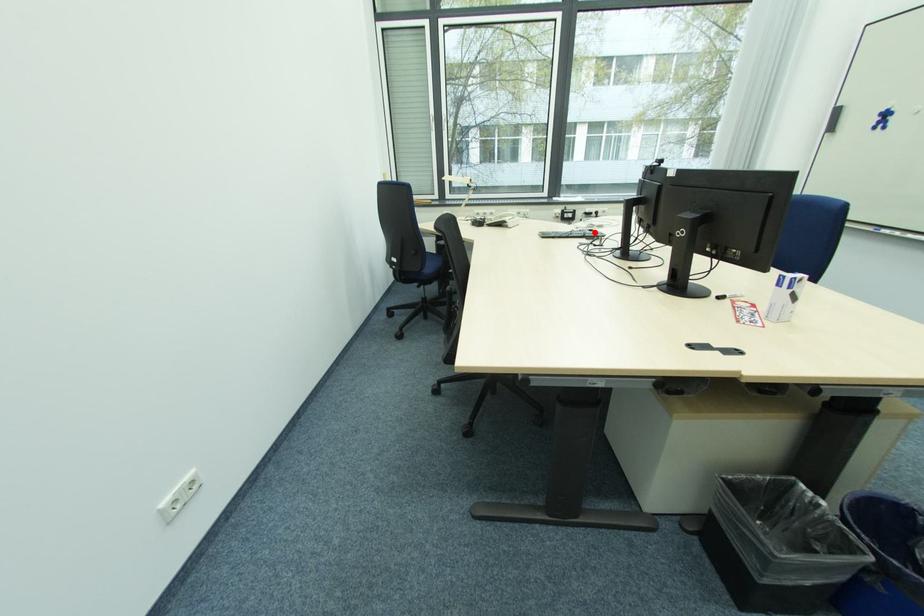
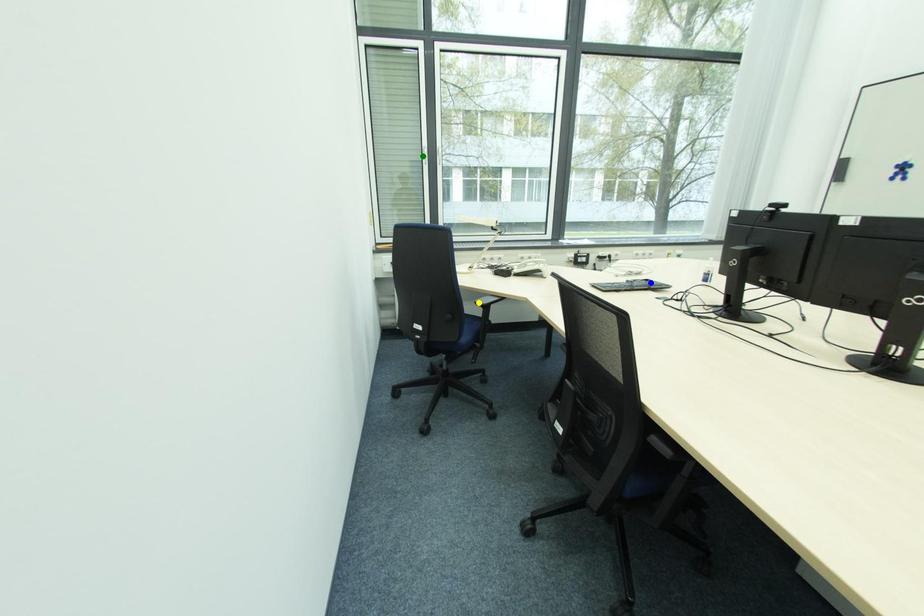
Question: I am providing you with two images of the same scene from different viewpoints. A red point is marked on the first image. You are given multiple points on the second image. In image 2, which mark is for the same physical point as the one in image 1?

Choices:
 (A) yellow point
 (B) blue point
 (C) green point

Answer: (B)